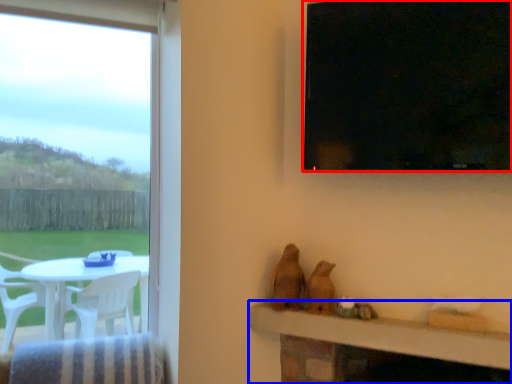
Question: Which object appears farthest to the camera in this image, window (highlighted by a red box) or table (highlighted by a blue box)?

Choices:
 (A) window
 (B) table

Answer: (B)